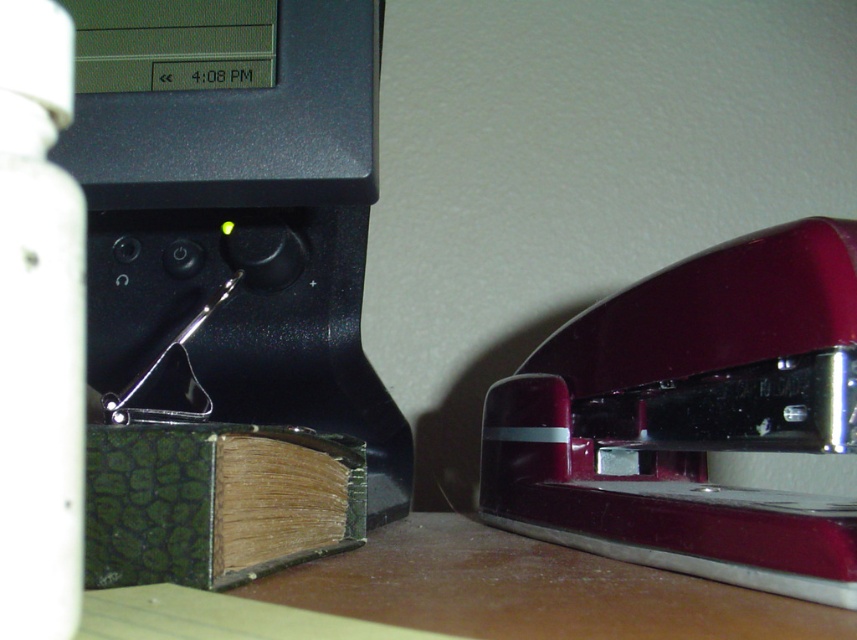
Question: Which point appears farthest from the camera in this image?

Choices:
 (A) (562, 452)
 (B) (57, 257)

Answer: (A)

Question: Does glossy maroon stapler at lower right have a larger size compared to white matte bottle at left?

Choices:
 (A) yes
 (B) no

Answer: (A)

Question: Considering the relative positions of glossy maroon stapler at lower right and green textured book at lower left in the image provided, where is glossy maroon stapler at lower right located with respect to green textured book at lower left?

Choices:
 (A) right
 (B) left

Answer: (A)

Question: Is white matte bottle at left bigger than green textured book at lower left?

Choices:
 (A) yes
 (B) no

Answer: (B)

Question: Which point is farther to the camera?

Choices:
 (A) pyautogui.click(x=178, y=436)
 (B) pyautogui.click(x=734, y=499)

Answer: (B)

Question: Which is nearer to the glossy maroon stapler at lower right?

Choices:
 (A) white matte bottle at left
 (B) green textured book at lower left

Answer: (B)